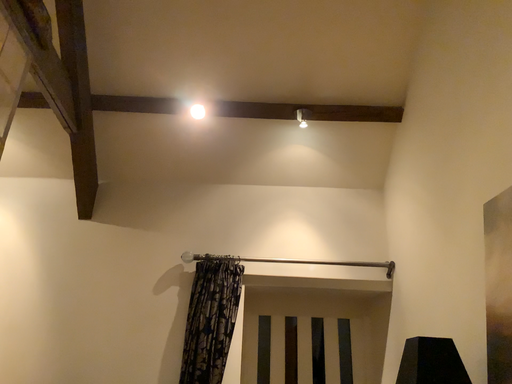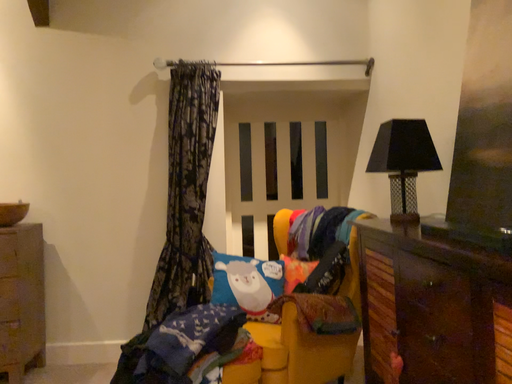
Question: How did the camera likely rotate when shooting the video?

Choices:
 (A) rotated upward
 (B) rotated downward

Answer: (B)